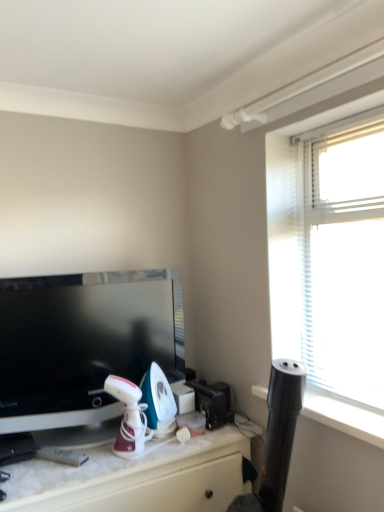
Measure the distance between black glossy television at left and camera.

A distance of 4.94 feet exists between black glossy television at left and camera.

You are a GUI agent. You are given a task and a screenshot of the screen. Output one action in this format:
    pyautogui.click(x=<x>, y=<y>)
    Task: Click on the black glossy television at left
    The height and width of the screenshot is (512, 384).
    Given the screenshot: What is the action you would take?
    pyautogui.click(x=83, y=343)

Describe the element at coordinates (83, 343) in the screenshot. I see `black glossy television at left` at that location.

This screenshot has width=384, height=512. What are the coordinates of `white marble desk at lower center` in the screenshot? It's located at (135, 474).

The image size is (384, 512). What do you see at coordinates (135, 474) in the screenshot?
I see `white marble desk at lower center` at bounding box center [135, 474].

Identify the location of black glossy television at left. Image resolution: width=384 pixels, height=512 pixels. (83, 343).

Would you say white marble desk at lower center is to the left or to the right of black glossy television at left in the picture?

white marble desk at lower center is positioned on black glossy television at left's right side.

Between white marble desk at lower center and black glossy television at left, which one is positioned behind?

black glossy television at left is further from the camera.

Which point is more forward, [41,483] or [71,298]?

The point [41,483] is closer to the camera.

From the image's perspective, is white marble desk at lower center positioned above or below black glossy television at left?

white marble desk at lower center is below black glossy television at left.

From a real-world perspective, between white marble desk at lower center and black glossy television at left, who is vertically lower?

white marble desk at lower center, from a real-world perspective.

Is white marble desk at lower center wider than black glossy television at left?

Yes, white marble desk at lower center is wider than black glossy television at left.

Which of these two, white marble desk at lower center or black glossy television at left, stands shorter?

white marble desk at lower center.

Is white marble desk at lower center bigger than black glossy television at left?

Indeed, white marble desk at lower center has a larger size compared to black glossy television at left.

Is white marble desk at lower center not within black glossy television at left?

Yes, white marble desk at lower center is not within black glossy television at left.

Is the surface of white marble desk at lower center in direct contact with black glossy television at left?

They are not placed beside each other.

Is white marble desk at lower center looking in the opposite direction of black glossy television at left?

No, black glossy television at left is not at the back of white marble desk at lower center.

How different are the orientations of white marble desk at lower center and black glossy television at left in degrees?

1.1 degrees separate the facing orientations of white marble desk at lower center and black glossy television at left.

Measure the distance from white marble desk at lower center to black glossy television at left.

They are 13.13 inches apart.

Where is `desk on the right of black glossy television at left`? The width and height of the screenshot is (384, 512). desk on the right of black glossy television at left is located at coordinates (135, 474).

Between black glossy television at left and white marble desk at lower center, which one appears on the right side from the viewer's perspective?

From the viewer's perspective, white marble desk at lower center appears more on the right side.

Is the position of black glossy television at left less distant than that of white marble desk at lower center?

No, the depth of black glossy television at left is greater than that of white marble desk at lower center.

Does point (76, 325) come in front of point (218, 477)?

No, (76, 325) is further to viewer.

From the image's perspective, is black glossy television at left under white marble desk at lower center?

Actually, black glossy television at left appears above white marble desk at lower center in the image.

From a real-world perspective, is black glossy television at left physically below white marble desk at lower center?

No.

Consider the image. Is black glossy television at left wider or thinner than white marble desk at lower center?

black glossy television at left is thinner than white marble desk at lower center.

From their relative heights in the image, would you say black glossy television at left is taller or shorter than white marble desk at lower center?

In the image, black glossy television at left appears to be taller than white marble desk at lower center.

Based on their sizes in the image, would you say black glossy television at left is bigger or smaller than white marble desk at lower center?

Clearly, black glossy television at left is smaller in size than white marble desk at lower center.

Can we say black glossy television at left lies outside white marble desk at lower center?

Yes, black glossy television at left is located beyond the bounds of white marble desk at lower center.

Are black glossy television at left and white marble desk at lower center far apart?

Actually, black glossy television at left and white marble desk at lower center are a little close together.

Is black glossy television at left looking in the opposite direction of white marble desk at lower center?

black glossy television at left does not have its back to white marble desk at lower center.

How different are the orientations of black glossy television at left and white marble desk at lower center in degrees?

The facing directions of black glossy television at left and white marble desk at lower center are 1.1 degrees apart.

In the scene shown: How far apart are black glossy television at left and white marble desk at lower center?

13.13 inches.

I want to click on television that is on the left side of white marble desk at lower center, so click(83, 343).

The image size is (384, 512). I want to click on television behind the white marble desk at lower center, so coord(83,343).

In the image, there is a black glossy television at left. At what (x,y) coordinates should I click in order to perform the action: click on desk below it (from a real-world perspective). Please return your answer as a coordinate pair (x, y). The width and height of the screenshot is (384, 512). Looking at the image, I should click on (135, 474).